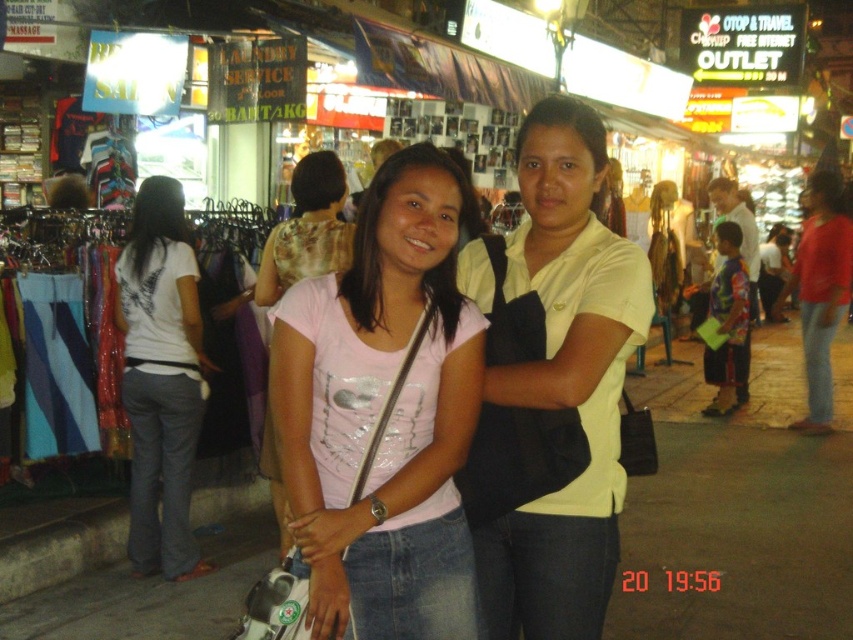
Question: Which point appears closest to the camera in this image?

Choices:
 (A) (265, 474)
 (B) (134, 228)
 (C) (538, 381)

Answer: (C)

Question: Does yellow matte shirt at center appear on the left side of white cotton shirt at left?

Choices:
 (A) no
 (B) yes

Answer: (A)

Question: Is white cotton shirt at left thinner than pink fabric shirt at center?

Choices:
 (A) yes
 (B) no

Answer: (A)

Question: Among these objects, which one is nearest to the camera?

Choices:
 (A) white cotton shirt at left
 (B) pink fabric shirt at center
 (C) matte pink shirt at center

Answer: (C)

Question: Is white cotton shirt at left to the left of pink fabric shirt at center from the viewer's perspective?

Choices:
 (A) no
 (B) yes

Answer: (B)

Question: Which point is closer to the camera?

Choices:
 (A) white cotton shirt at left
 (B) pink fabric shirt at center
 (C) matte pink shirt at center
 (D) yellow matte shirt at center

Answer: (C)